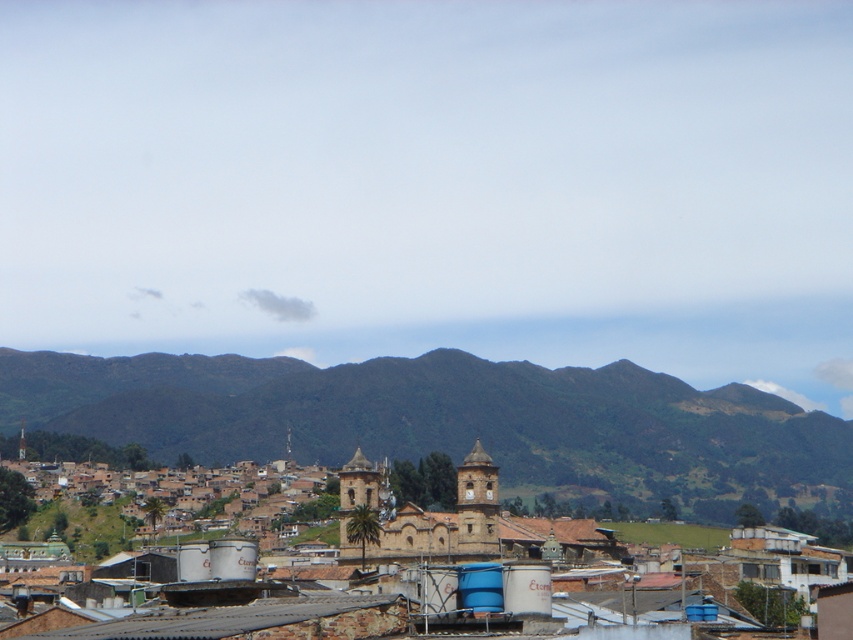
You are standing in the town square and want to walk to the green grassy mountain at center and the brown stone church at center. Which one will you reach first?

You will reach the brown stone church at center first because it is closer to you than the green grassy mountain at center, which is further away.

You are a hiker standing at the base of the green grassy mountain at center. You want to reach the brown stone church at center. Given that the distance between them is 356.50 meters, how many minutes would it take you to walk there at a leisurely pace of 3 km per hour?

At a leisurely pace of 3 km per hour, walking 356.50 meters would take approximately 7.13 minutes. Therefore, it would take about 7 minutes to reach the brown stone church at center from the green grassy mountain at center.

You are a tourist standing in the town square and want to take a photo that includes both the green grassy mountain at center and the brown stone church at center. Which object should you position closer to the edge of the frame to ensure both fit in the shot?

You should position the brown stone church at center closer to the edge of the frame because the green grassy mountain at center is wider, so placing the narrower brown stone church at center near the edge allows both to fit within the photo.